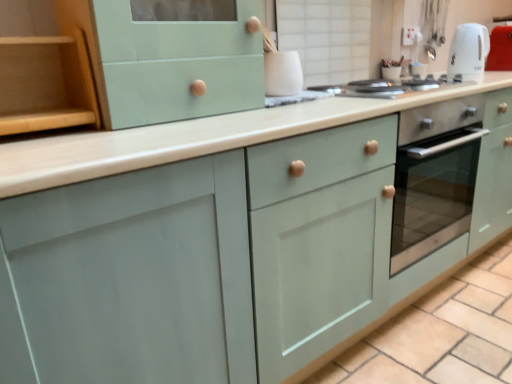
At what (x,y) coordinates should I click in order to perform the action: click on vacant space in front of wooden shelf at left. Please return your answer as a coordinate pair (x, y). This screenshot has width=512, height=384. Looking at the image, I should click on (45, 149).